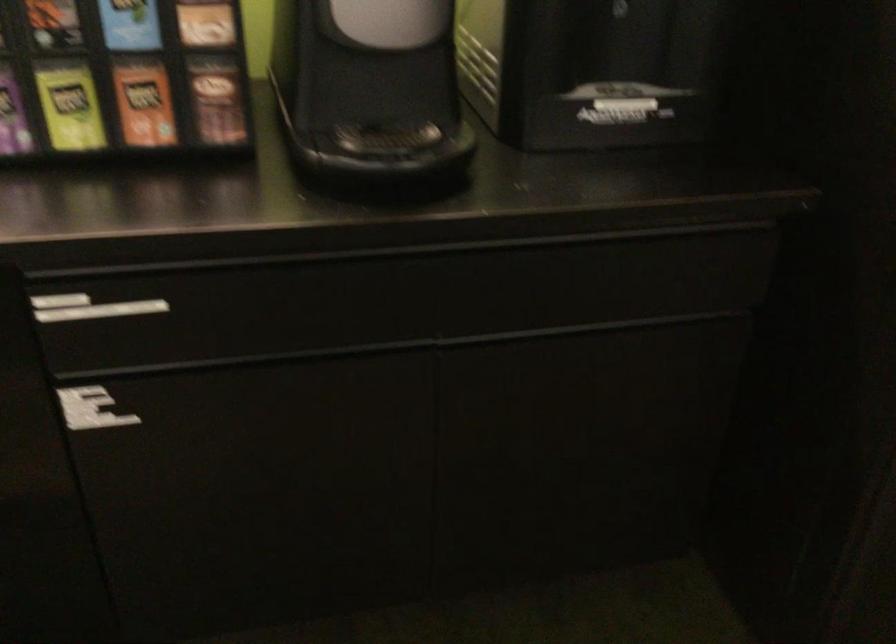
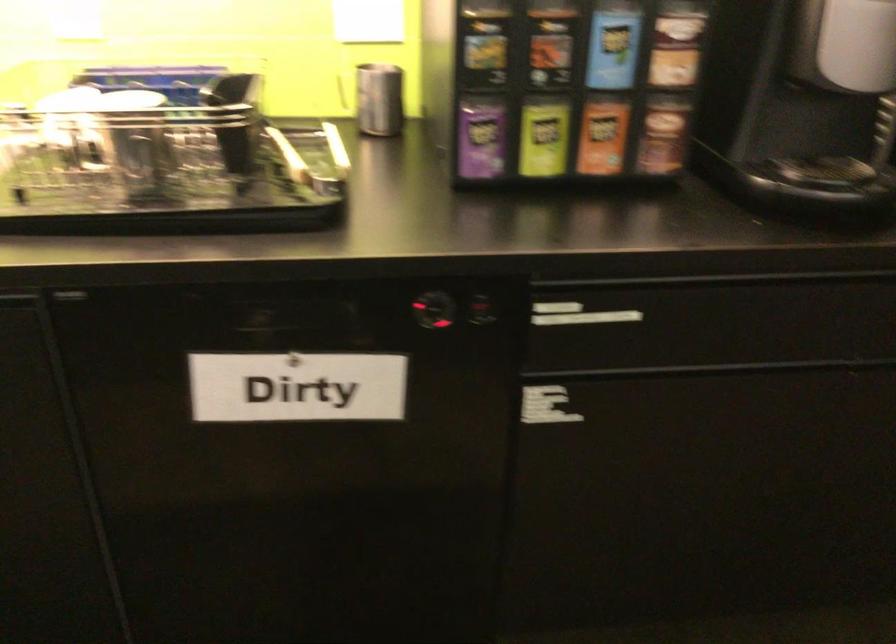
Find the pixel in the second image that matches pixel 92 306 in the first image.

(578, 315)